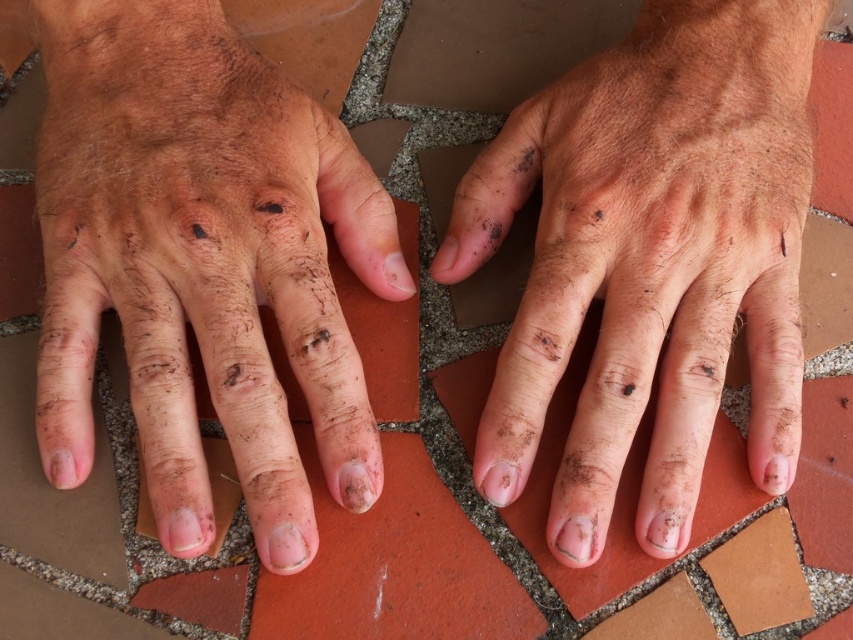
Which is above, dry skin at center or dirty skin hand at center?

dirty skin hand at center is above.

Describe the element at coordinates (202, 262) in the screenshot. I see `dry skin at center` at that location.

This screenshot has height=640, width=853. What are the coordinates of `dry skin at center` in the screenshot? It's located at [202, 262].